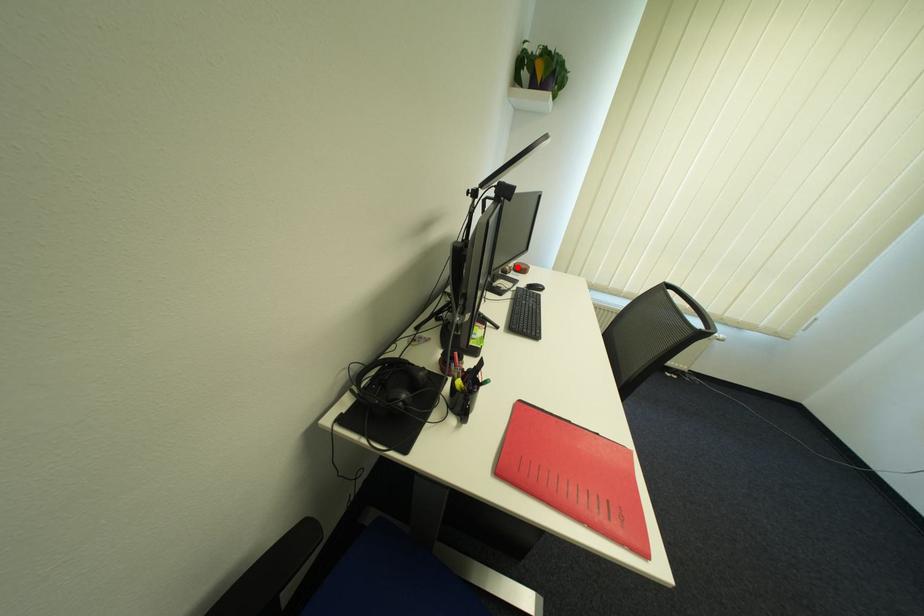
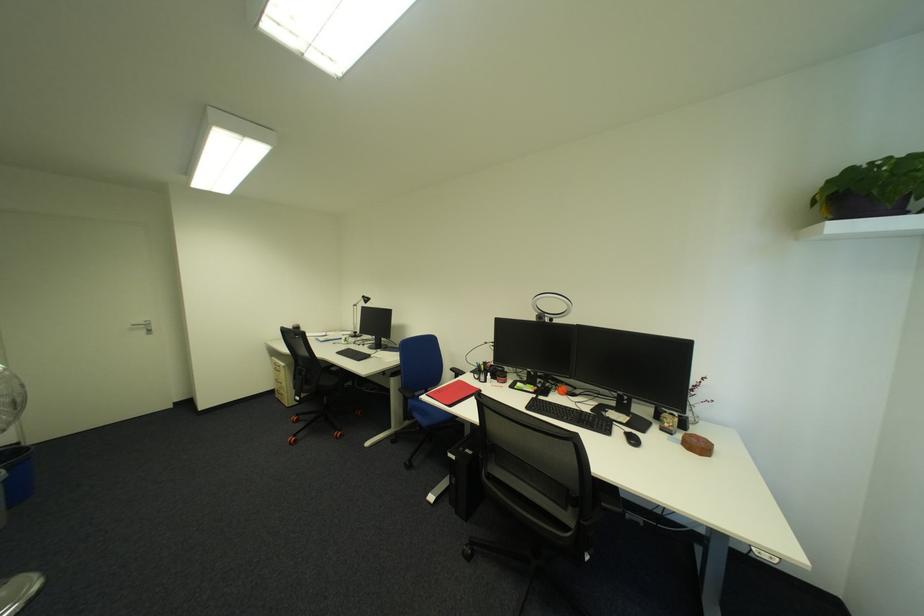
The point at the highlighted location is marked in the first image. Where is the corresponding point in the second image?

(677, 424)